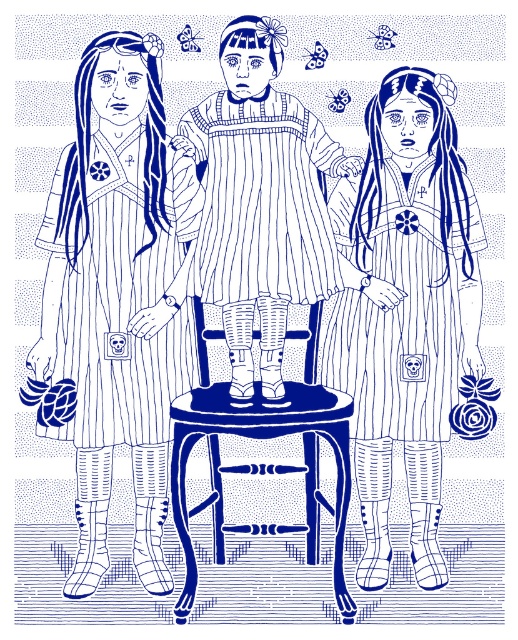
Between point (249, 278) and point (241, 525), which one is positioned behind?

The point (241, 525) is more distant.

At what (x,y) coordinates should I click in order to perform the action: click on striped fabric apron at center. Please return your answer as a coordinate pair (x, y). Image resolution: width=518 pixels, height=640 pixels. Looking at the image, I should click on (263, 198).

Where is `striped fabric dress at left`? This screenshot has width=518, height=640. striped fabric dress at left is located at coordinates (119, 298).

I want to click on striped fabric dress at left, so click(119, 298).

Can you confirm if matte striped dress at center is positioned to the right of wooden chair at center?

Correct, you'll find matte striped dress at center to the right of wooden chair at center.

Is matte striped dress at center in front of wooden chair at center?

No, matte striped dress at center is further to the viewer.

Is point (447, 202) less distant than point (313, 554)?

That is True.

At what (x,y) coordinates should I click in order to perform the action: click on matte striped dress at center. Please return your answer as a coordinate pair (x, y). The width and height of the screenshot is (518, 640). Looking at the image, I should click on (405, 308).